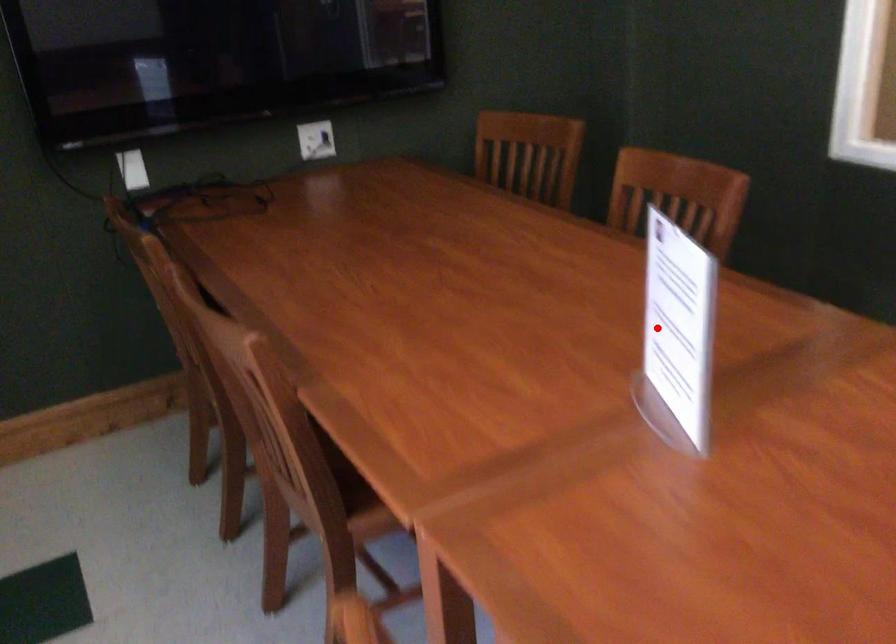
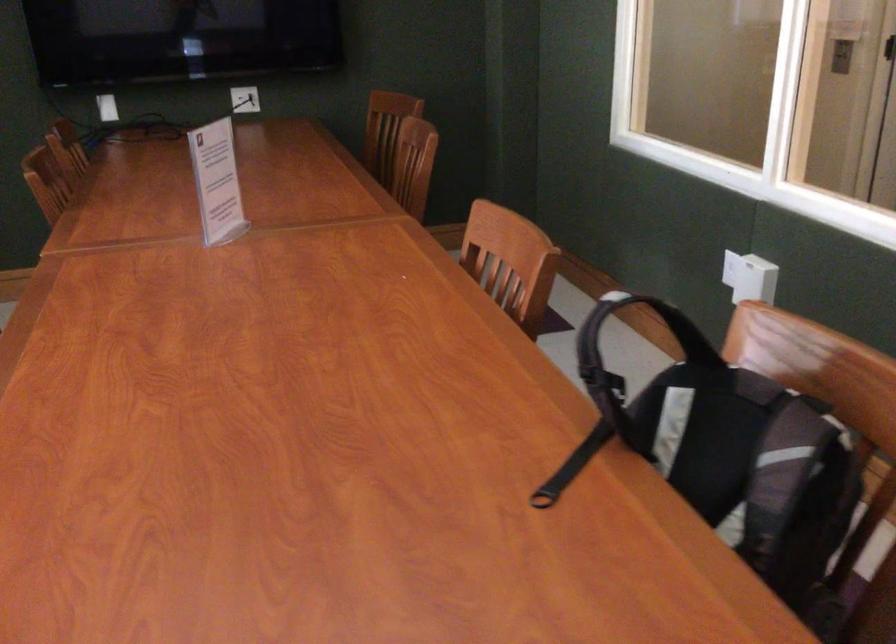
Question: I am providing you with two images of the same scene from different viewpoints. Image1 has a red point marked. In image2, the corresponding 3D location appears at what relative position? Reply with the corresponding letter.

Choices:
 (A) Closer
 (B) Farther

Answer: (B)